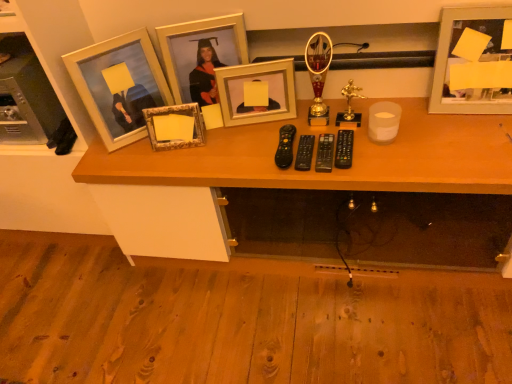
Question: Should I look upward or downward to see matte wooden picture frame at left, the fifth picture frame when ordered from right to left?

Choices:
 (A) up
 (B) down

Answer: (A)

Question: From the image's perspective, is matte wooden picture frame at left, the 1th picture frame viewed from the left, beneath gold metallic picture frame at upper center, arranged as the 3th picture frame when viewed from the left?

Choices:
 (A) yes
 (B) no

Answer: (A)

Question: Is matte wooden picture frame at left, the fifth picture frame when ordered from right to left, smaller than gold metallic picture frame at upper center, placed as the third picture frame when sorted from right to left?

Choices:
 (A) no
 (B) yes

Answer: (A)

Question: Is matte wooden picture frame at left, the fifth picture frame when ordered from right to left, wider than gold metallic picture frame at upper center, arranged as the 3th picture frame when viewed from the left?

Choices:
 (A) no
 (B) yes

Answer: (B)

Question: Does matte wooden picture frame at left, the 1th picture frame viewed from the left, have a lesser height compared to gold metallic picture frame at upper center, placed as the third picture frame when sorted from right to left?

Choices:
 (A) yes
 (B) no

Answer: (A)

Question: Is matte wooden picture frame at left, the fifth picture frame when ordered from right to left, positioned behind gold metallic picture frame at upper center, placed as the third picture frame when sorted from right to left?

Choices:
 (A) no
 (B) yes

Answer: (A)

Question: Can you confirm if matte wooden picture frame at left, the fifth picture frame when ordered from right to left, is thinner than gold metallic picture frame at upper center, arranged as the 3th picture frame when viewed from the left?

Choices:
 (A) no
 (B) yes

Answer: (A)

Question: Considering the relative sizes of metallic silver picture frame at upper right, the first picture frame from the right, and wooden desk at center in the image provided, is metallic silver picture frame at upper right, the first picture frame from the right, smaller than wooden desk at center?

Choices:
 (A) yes
 (B) no

Answer: (A)

Question: From the image's perspective, would you say metallic silver picture frame at upper right, the fifth picture frame in the left-to-right sequence, is positioned over wooden desk at center?

Choices:
 (A) no
 (B) yes

Answer: (B)

Question: Considering the relative sizes of metallic silver picture frame at upper right, the fifth picture frame in the left-to-right sequence, and wooden desk at center in the image provided, is metallic silver picture frame at upper right, the fifth picture frame in the left-to-right sequence, bigger than wooden desk at center?

Choices:
 (A) yes
 (B) no

Answer: (B)

Question: Does metallic silver picture frame at upper right, the fifth picture frame in the left-to-right sequence, have a lesser width compared to wooden desk at center?

Choices:
 (A) no
 (B) yes

Answer: (B)

Question: Considering the relative positions of metallic silver picture frame at upper right, the fifth picture frame in the left-to-right sequence, and wooden desk at center in the image provided, is metallic silver picture frame at upper right, the fifth picture frame in the left-to-right sequence, in front of wooden desk at center?

Choices:
 (A) yes
 (B) no

Answer: (B)

Question: Would you say wooden desk at center is part of metallic silver picture frame at upper right, the fifth picture frame in the left-to-right sequence,'s contents?

Choices:
 (A) no
 (B) yes

Answer: (A)

Question: Does gold metallic picture frame at upper center, arranged as the 3th picture frame when viewed from the left, have a larger size compared to gold metallic picture frame at center, marked as the second picture frame in a right-to-left arrangement?

Choices:
 (A) yes
 (B) no

Answer: (A)